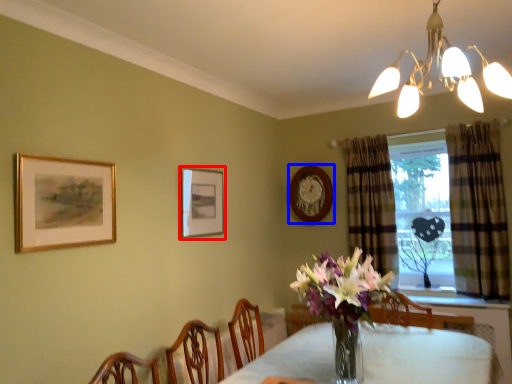
Question: Among these objects, which one is nearest to the camera, picture frame (highlighted by a red box) or picture frame (highlighted by a blue box)?

Choices:
 (A) picture frame
 (B) picture frame

Answer: (A)